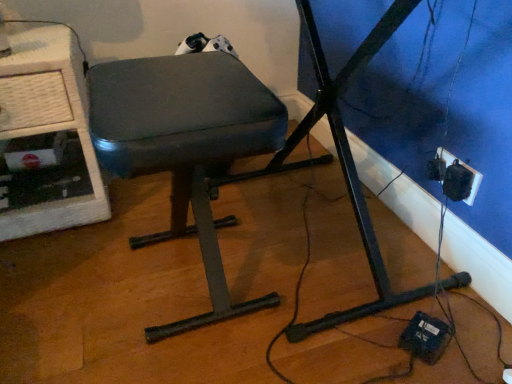
This screenshot has width=512, height=384. Identify the location of free spot to the left of matte black stool at center. (65, 288).